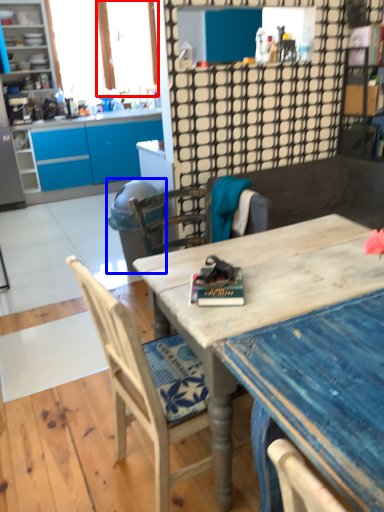
Question: Which object appears closest to the camera in this image, window screen (highlighted by a red box) or trash bin/can (highlighted by a blue box)?

Choices:
 (A) window screen
 (B) trash bin/can

Answer: (B)